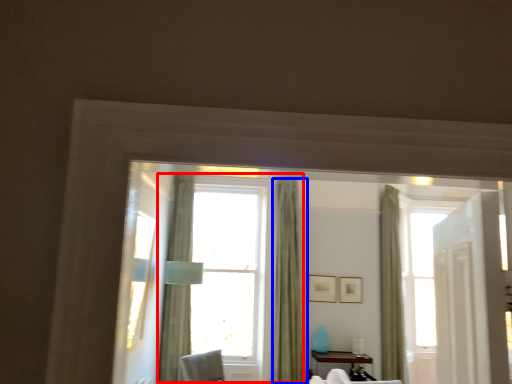
Question: Which object is further to the camera taking this photo, window (highlighted by a red box) or curtain (highlighted by a blue box)?

Choices:
 (A) window
 (B) curtain

Answer: (A)